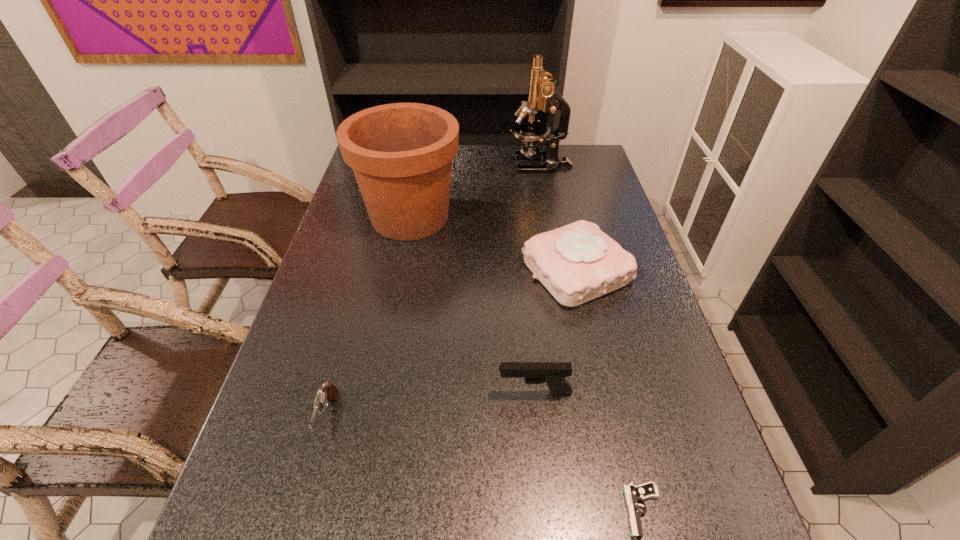
Identify the location of cake situated at the right edge. The width and height of the screenshot is (960, 540). (577, 263).

Identify the location of object at the far right corner. The image size is (960, 540). (542, 94).

In order to click on free spot at the far edge of the desktop in this screenshot , I will do `click(536, 176)`.

In the image, there is a desktop. Where is `free space at the left edge`? free space at the left edge is located at coordinates (307, 354).

You are a GUI agent. You are given a task and a screenshot of the screen. Output one action in this format:
    pyautogui.click(x=<x>, y=<y>)
    Task: Click on the vacant area at the right edge of the desktop
    The height and width of the screenshot is (540, 960).
    Given the screenshot: What is the action you would take?
    pyautogui.click(x=627, y=289)

What are the coordinates of `empty space that is in between the cake and the flowerpot` in the screenshot? It's located at (493, 244).

Locate an element on the screen. The image size is (960, 540). vacant space in between the tallest pistol and the fifth shortest object is located at coordinates tap(472, 305).

Locate an element on the screen. The image size is (960, 540). blank region between the cake and the farthest object is located at coordinates (558, 218).

Identify the location of unoccupied position between the farthest object and the cake. (558, 218).

Image resolution: width=960 pixels, height=540 pixels. Identify the location of free point between the flowerpot and the tallest object. (475, 191).